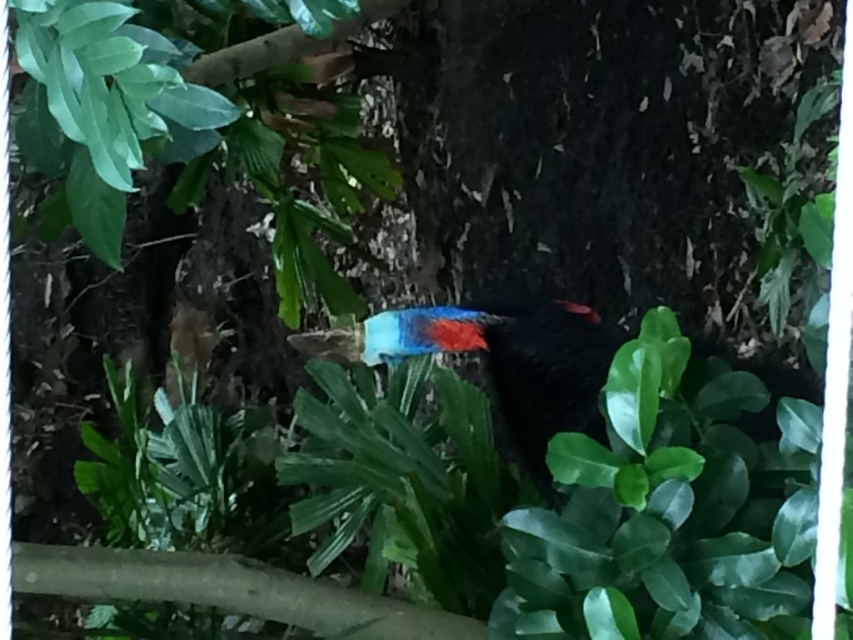
Question: Which of the following is the closest to the observer?

Choices:
 (A) shiny blue and red feathers at center
 (B) smooth brown branch at lower left

Answer: (A)

Question: Which point is closer to the camera taking this photo?

Choices:
 (A) (256, 566)
 (B) (573, 397)

Answer: (B)

Question: Can you confirm if shiny blue and red feathers at center is bigger than smooth brown branch at lower left?

Choices:
 (A) yes
 (B) no

Answer: (A)

Question: In this image, where is shiny blue and red feathers at center located relative to smooth brown branch at lower left?

Choices:
 (A) below
 (B) above

Answer: (B)

Question: Among these points, which one is farthest from the camera?

Choices:
 (A) (418, 342)
 (B) (241, 564)

Answer: (B)

Question: Is shiny blue and red feathers at center to the right of smooth brown branch at lower left from the viewer's perspective?

Choices:
 (A) no
 (B) yes

Answer: (B)